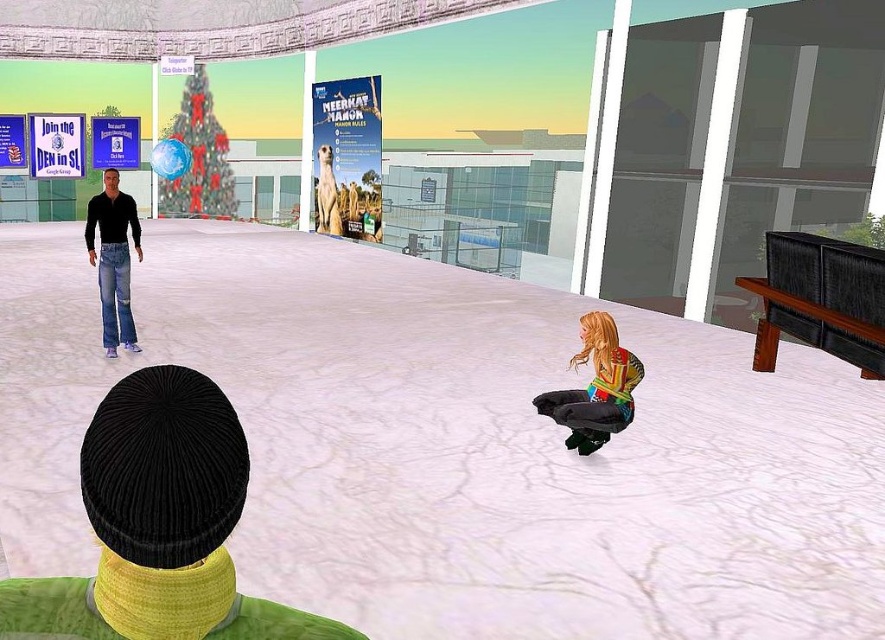
You are standing in the virtual environment and want to place a small object between the white textured ice at center and the black corduroy beanie at center. Based on their positions, where should you place it?

The white textured ice at center is to the left of the black corduroy beanie at center, so you should place the small object in between them on the right side of the white textured ice and the left side of the black corduroy beanie.

You are a character in the virtual environment and need to reach the multicolored fabric dress at lower right. There is a black corduroy beanie at center blocking your path. Can you walk around it to get to the dress?

The black corduroy beanie at center is positioned over the multicolored fabric dress at lower right, so you can walk around the beanie to reach the dress since it is blocking the direct path but not covering the dress entirely.